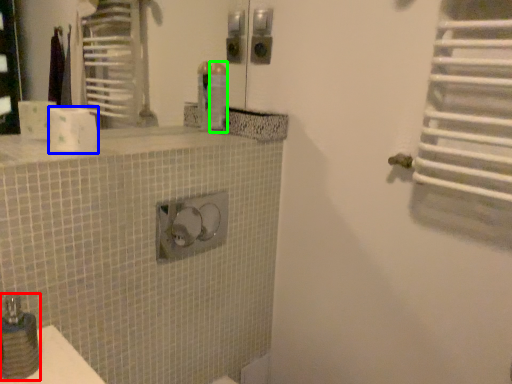
Question: Which object is the closest to the soap dispenser (highlighted by a red box)? Choose among these: toilet paper (highlighted by a blue box) or toiletry (highlighted by a green box).

Choices:
 (A) toilet paper
 (B) toiletry

Answer: (A)